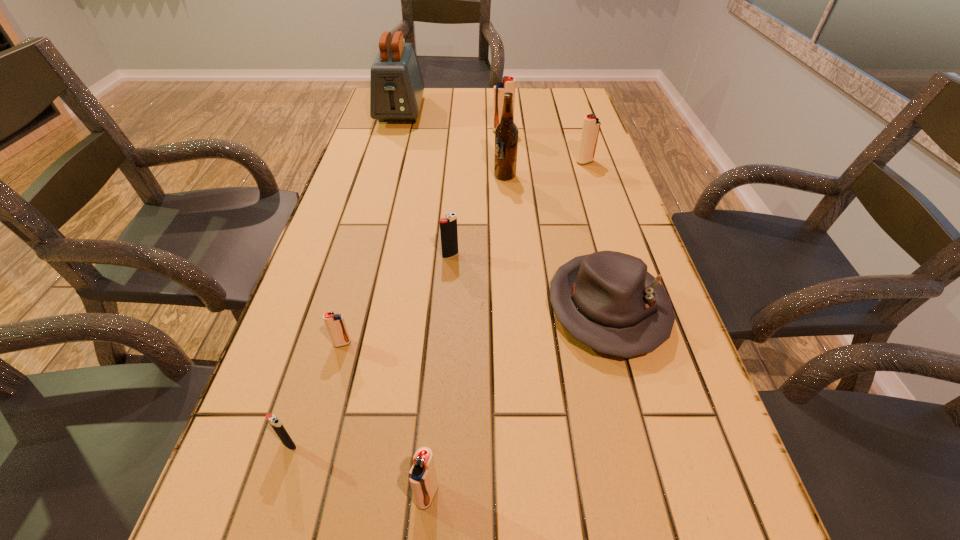
Image resolution: width=960 pixels, height=540 pixels. Identify the location of vacant space in between the third farthest object and the eighth farthest object. (437, 303).

Where is `vacant area that lies between the third farthest object and the smaller black igniter`? vacant area that lies between the third farthest object and the smaller black igniter is located at coordinates (437, 303).

The height and width of the screenshot is (540, 960). I want to click on free space between the left black igniter and the fourth farthest object, so click(x=397, y=310).

Locate which object ranks eighth in proximity to the hat. Please provide its 2D coordinates. Your answer should be formatted as a tuple, i.e. [(x, y)], where the tuple contains the x and y coordinates of a point satisfying the conditions above.

[(396, 85)]

Where is `object that stands as the seventh closest to the nearest igniter`? This screenshot has height=540, width=960. object that stands as the seventh closest to the nearest igniter is located at coordinates coord(508,85).

This screenshot has height=540, width=960. I want to click on igniter that is the fourth closest one to the fourth farthest object, so click(x=335, y=323).

Point out which igniter is positioned as the fifth nearest to the rightmost igniter. Please provide its 2D coordinates. Your answer should be formatted as a tuple, i.e. [(x, y)], where the tuple contains the x and y coordinates of a point satisfying the conditions above.

[(274, 421)]

What are the coordinates of `red igniter that is the second nearest to the third biggest red igniter` in the screenshot? It's located at (591, 125).

Select which red igniter appears as the second closest to the leftmost igniter. Please provide its 2D coordinates. Your answer should be formatted as a tuple, i.e. [(x, y)], where the tuple contains the x and y coordinates of a point satisfying the conditions above.

[(422, 475)]

What are the coordinates of `vacant area in the image that satisfies the following two spatial constraints: 1. on the back side of the nearer black igniter; 2. on the right side of the bigger black igniter` in the screenshot? It's located at (348, 255).